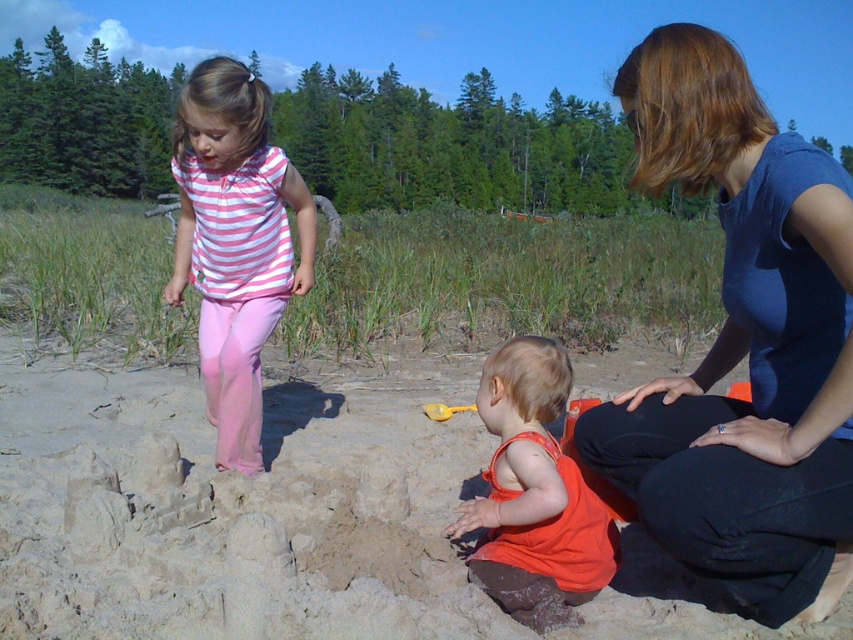
Which is behind, point (714, 544) or point (573, 515)?

The point (573, 515) is behind.

You are a GUI agent. You are given a task and a screenshot of the screen. Output one action in this format:
    pyautogui.click(x=<x>, y=<y>)
    Task: Click on the blue fabric dress at center
    
    Given the screenshot: What is the action you would take?
    pyautogui.click(x=743, y=342)

Can you confirm if blue fabric dress at center is positioned to the left of yellow plastic shovel at center?

Incorrect, blue fabric dress at center is not on the left side of yellow plastic shovel at center.

Who is more forward, (730, 308) or (462, 410)?

Positioned in front is point (730, 308).

Identify the location of blue fabric dress at center. 743,342.

How distant is orange fabric toddler at center from yellow plastic shovel at center?

The distance of orange fabric toddler at center from yellow plastic shovel at center is 7.70 feet.

Does orange fabric toddler at center have a larger size compared to yellow plastic shovel at center?

Indeed, orange fabric toddler at center has a larger size compared to yellow plastic shovel at center.

Where is `orange fabric toddler at center`? This screenshot has width=853, height=640. orange fabric toddler at center is located at coordinates (534, 493).

Find the location of a particular element. This screenshot has height=640, width=853. orange fabric toddler at center is located at coordinates (534, 493).